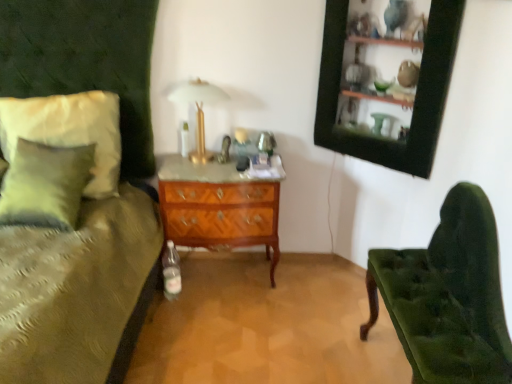
I want to click on free area below gold metallic table lamp at upper center (from a real-world perspective), so click(x=199, y=160).